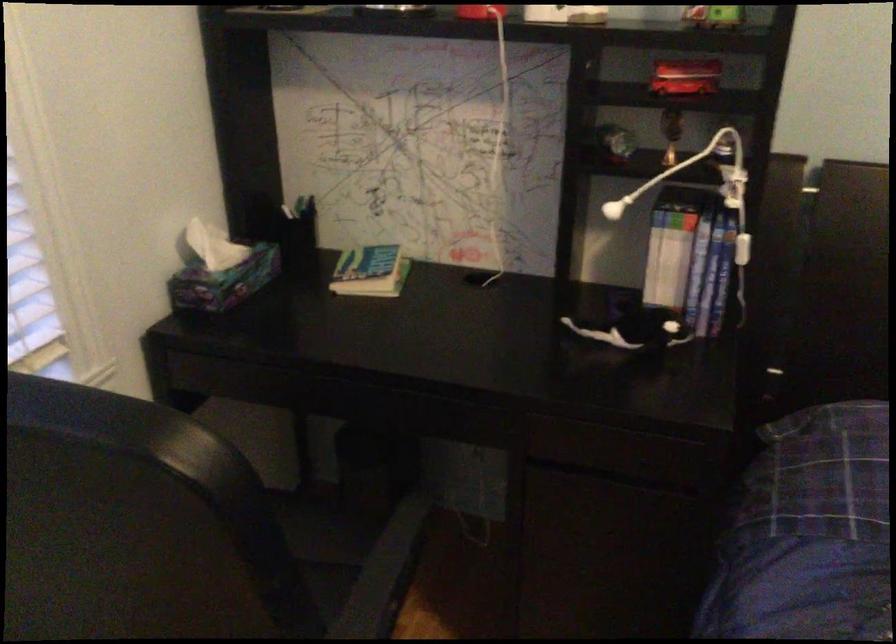
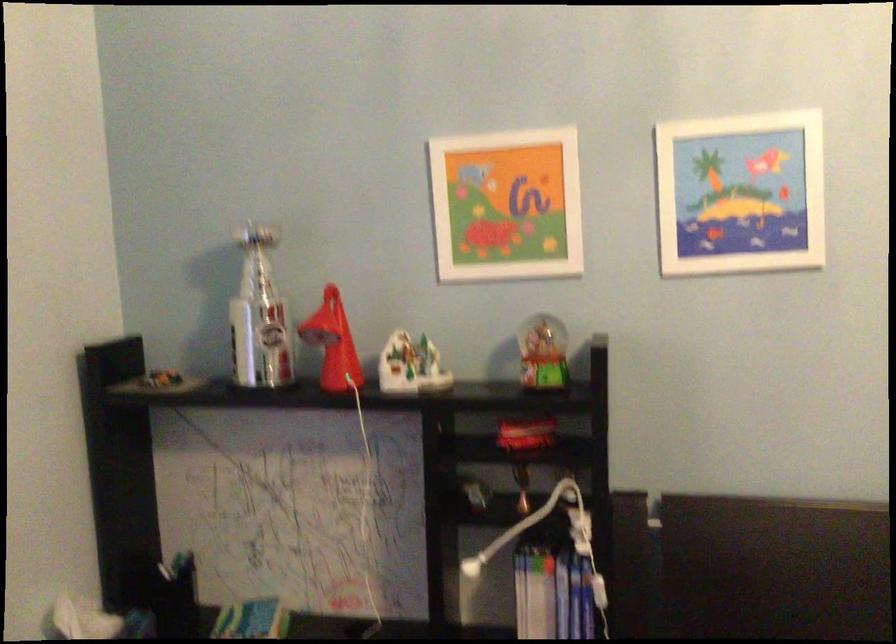
Question: How did the camera likely rotate?

Choices:
 (A) Left
 (B) Right
 (C) Up
 (D) Down

Answer: (C)